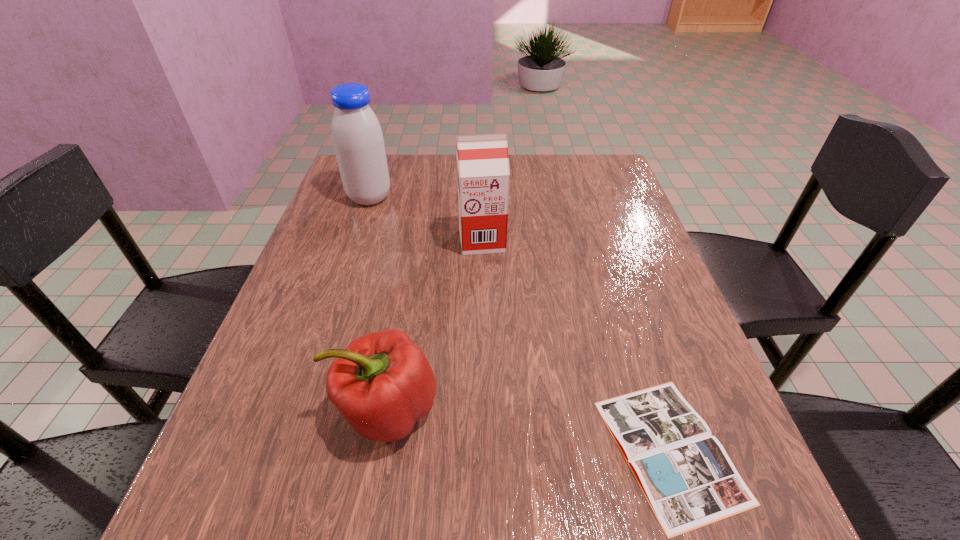
Locate an element on the screen. Image resolution: width=960 pixels, height=540 pixels. free spot between the rightmost object and the third object from left to right is located at coordinates (576, 345).

Identify the location of the second closest object to the shortest object. (483, 176).

You are a GUI agent. You are given a task and a screenshot of the screen. Output one action in this format:
    pyautogui.click(x=<x>, y=<y>)
    Task: Click on the object that stands as the closest to the third nearest object
    
    Given the screenshot: What is the action you would take?
    pyautogui.click(x=358, y=141)

Find the location of a particular element. vacant space that satisfies the following two spatial constraints: 1. on the back side of the second farthest object; 2. on the right side of the bell pepper is located at coordinates (416, 240).